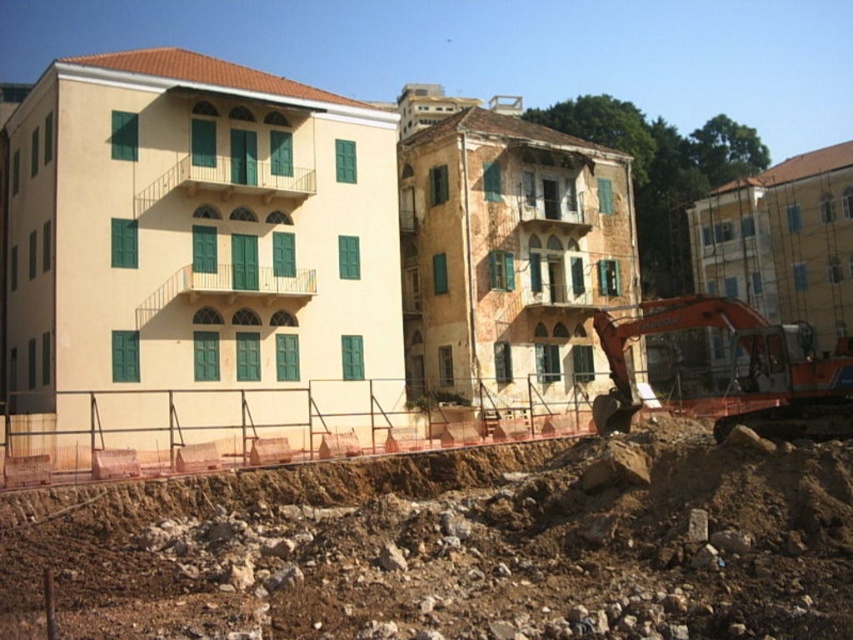
You are a construction worker who needs to move the orange metallic excavator at lower right to a different location. However, you must avoid moving it over the brown rocky dirt at lower center. Based on the scene, where could you safely move the excavator to?

The orange metallic excavator at lower right can be moved to an area not under it, such as the open space to the left or right of the brown rocky dirt at lower center, since the brown rocky dirt at lower center is positioned under the excavator currently.

You are a delivery drone carrying a package that requires a landing zone with flat terrain. You observe the scene and see the brown rocky dirt at lower center. Can you safely land there?

The brown rocky dirt at lower center is 24.92 meters away from the camera, but the description does not provide information about the terrain being flat or free of obstacles. Therefore, it is uncertain if the area is suitable for safe landing.